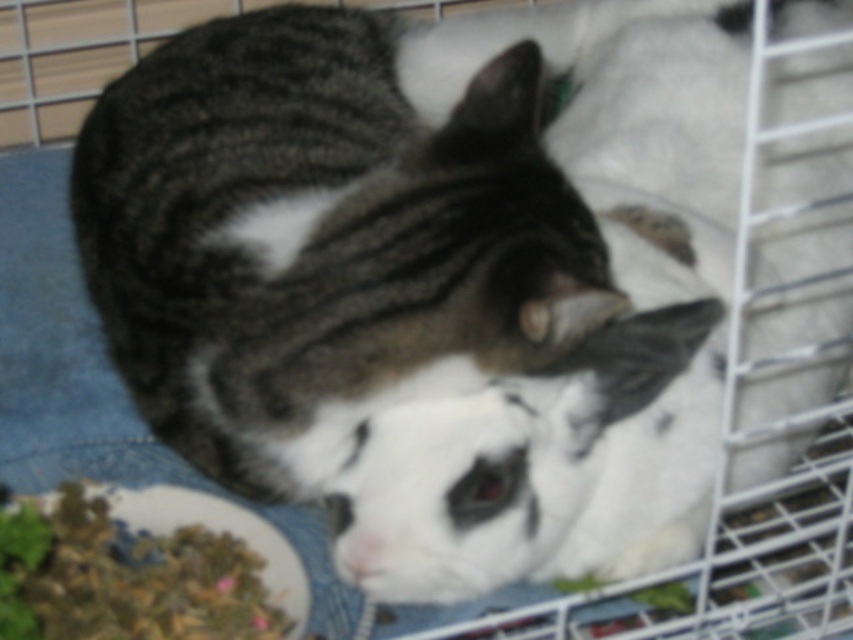
You are a pet owner trying to determine if there is enough space to place a new small toy between the gray tabby cat at center and the green leafy material at lower left. Based on their widths, can the toy fit between them?

The gray tabby cat at center is wider than the green leafy material at lower left, so there might be enough space to place the new small toy between them depending on the toy size.

You are a small toy that is 10 inches long. You want to move from the gray tabby cat at center to the green leafy material at lower left. Is there enough space for you to move between them?

The gray tabby cat at center is 11.34 inches away from the green leafy material at lower left. Since the toy is 10 inches long, there is enough space for it to move between them as the distance is greater than the toy length.

You are a pet owner who wants to place a new toy for the gray tabby cat at center. The toy needs to be placed on the green leafy material at lower left. Can the toy be placed directly under the cat without moving it?

The gray tabby cat at center is located above the green leafy material at lower left, so placing the toy directly under the cat would place it on the green leafy material at lower left.